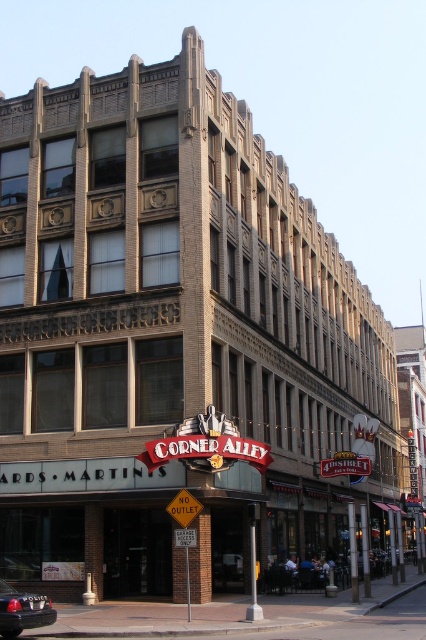
You are a delivery person needing to park your 3.5 meter long truck between the metallic silver sedan at lower left and the yellow plastic sign at lower center. Can you fit your truck there?

The distance between the metallic silver sedan at lower left and the yellow plastic sign at lower center is 6.56 meters. Since your truck is 3.5 meters long, there is enough space to park it between them.